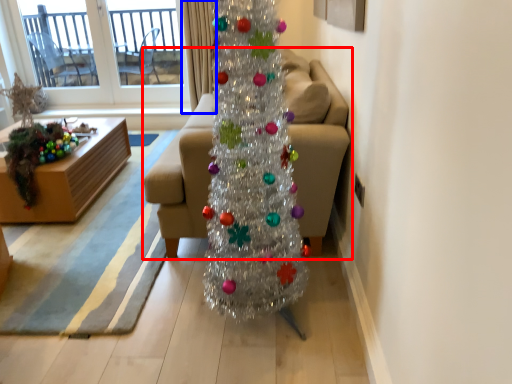
Question: Which object is further to the camera taking this photo, studio couch (highlighted by a red box) or curtain (highlighted by a blue box)?

Choices:
 (A) studio couch
 (B) curtain

Answer: (B)